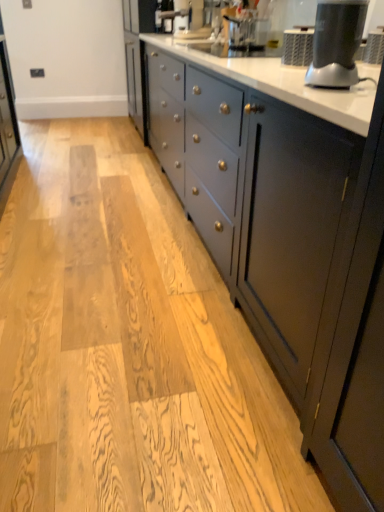
Question: From a real-world perspective, is white glossy countertop at center physically located above or below matte black blender at upper right?

Choices:
 (A) above
 (B) below

Answer: (B)

Question: In terms of width, does white glossy countertop at center look wider or thinner when compared to matte black blender at upper right?

Choices:
 (A) thin
 (B) wide

Answer: (B)

Question: Which object is the closest to the white glossy countertop at center?

Choices:
 (A) matte black coffee machine at upper center
 (B) matte black blender at upper right

Answer: (B)

Question: Which object is the farthest from the white glossy countertop at center?

Choices:
 (A) matte black coffee machine at upper center
 (B) matte black blender at upper right

Answer: (A)